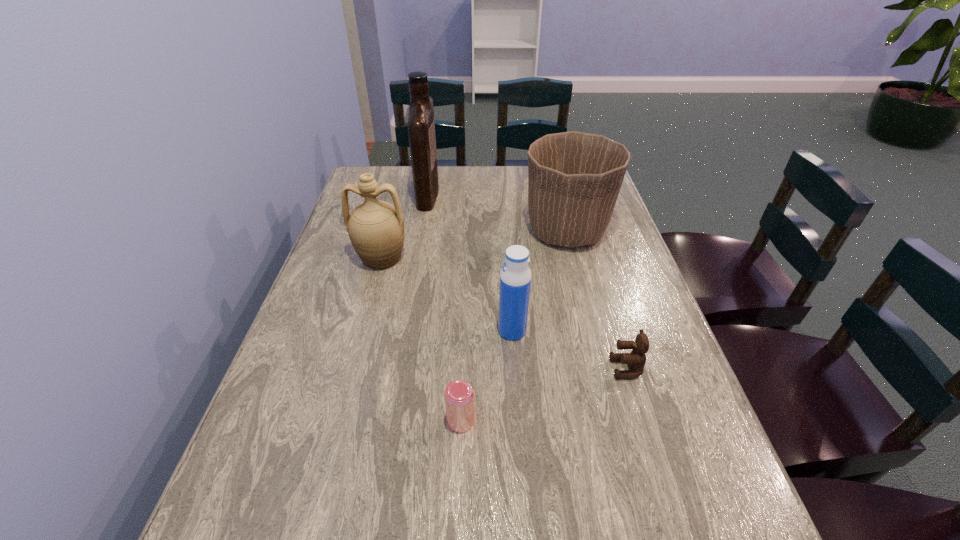
This screenshot has height=540, width=960. What are the coordinates of `free space at the far edge` in the screenshot? It's located at (413, 196).

I want to click on vacant space at the left edge of the desktop, so click(x=314, y=438).

This screenshot has width=960, height=540. In order to click on vacant space at the right edge of the desktop in this screenshot , I will do `click(599, 272)`.

The image size is (960, 540). I want to click on free space between the fourth object from left to right and the fifth farthest object, so click(569, 349).

Locate an element on the screen. The width and height of the screenshot is (960, 540). vacant space that is in between the beer can and the water bottle is located at coordinates (487, 376).

This screenshot has height=540, width=960. In order to click on free area in between the beer can and the liquor in this screenshot , I will do `click(444, 307)`.

What are the coordinates of `free point between the liquor and the flowerpot` in the screenshot? It's located at (497, 212).

Where is `free point between the pitcher and the fourth object from right to left`? The height and width of the screenshot is (540, 960). free point between the pitcher and the fourth object from right to left is located at coordinates click(420, 339).

I want to click on vacant space in between the nearest object and the teddy bear, so click(x=543, y=395).

Select which object is the fourth closest to the liquor. Please provide its 2D coordinates. Your answer should be formatted as a tuple, i.e. [(x, y)], where the tuple contains the x and y coordinates of a point satisfying the conditions above.

[(459, 395)]